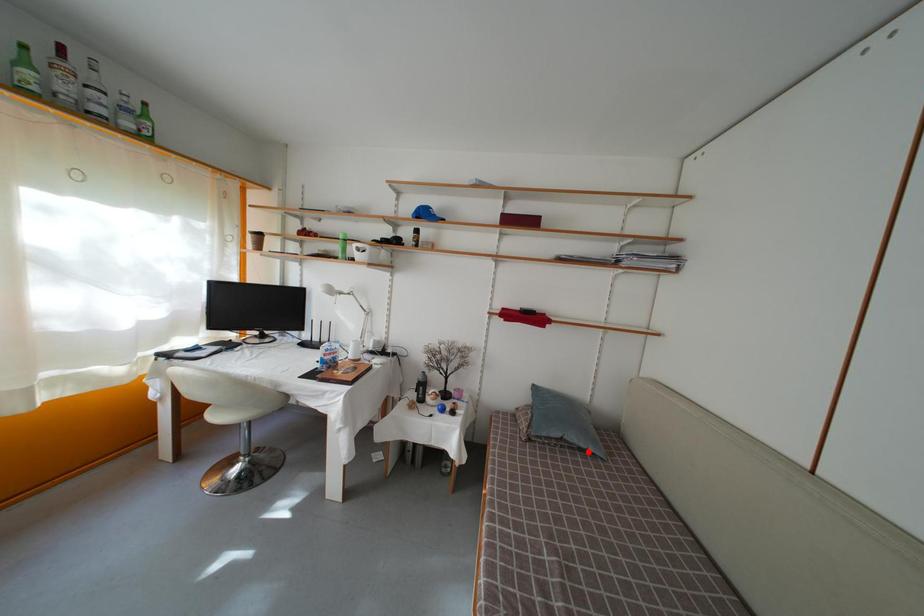
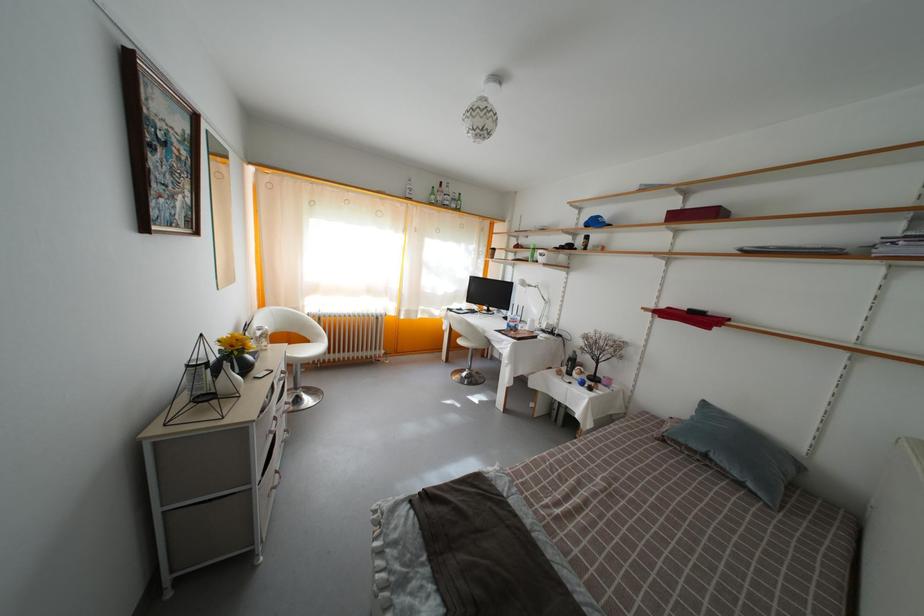
The point at the highlighted location is marked in the first image. Where is the corresponding point in the second image?

(743, 482)